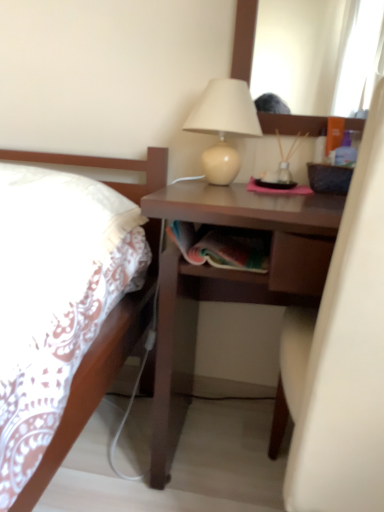
Find the location of a particular element. The image size is (384, 512). vacant region to the left of brown matte desk at center is located at coordinates (108, 445).